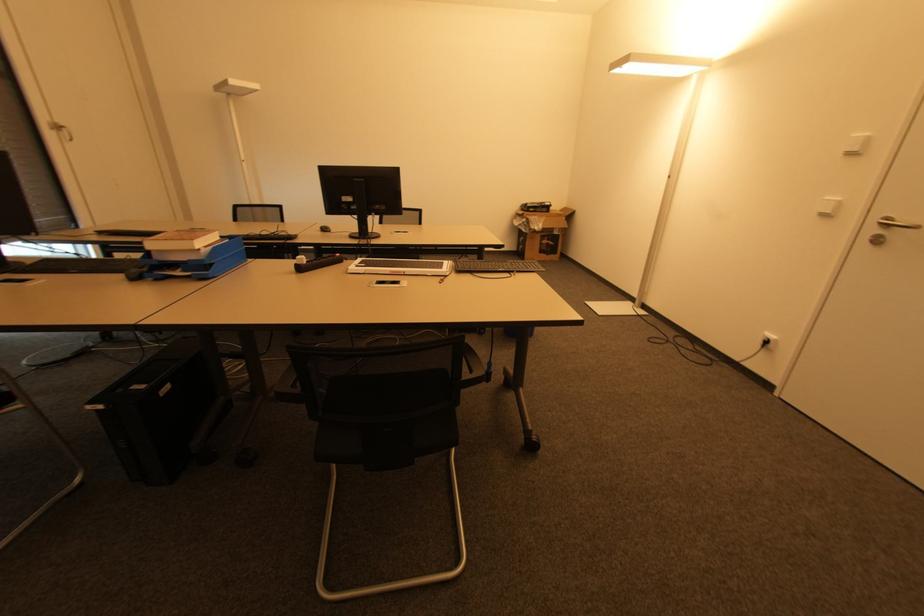
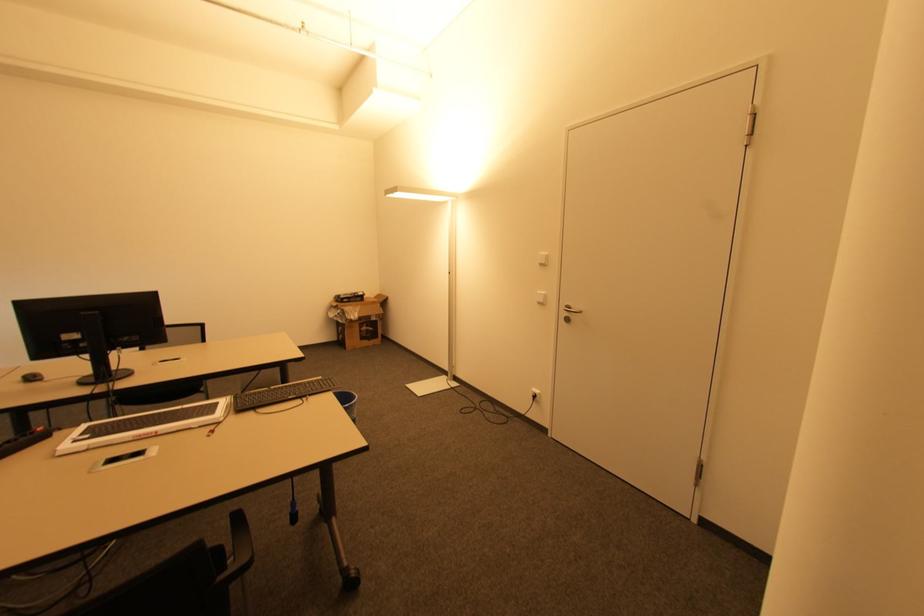
Where in the second image is the point corresponding to point (774, 338) from the first image?

(539, 392)